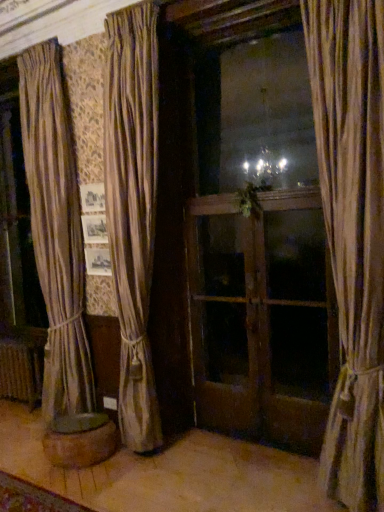
Where is `vacant area that lies between silky beige curtain at center, which ranks as the 1th curtain in back-to-front order, and brown wood stool at lower left`? Image resolution: width=384 pixels, height=512 pixels. vacant area that lies between silky beige curtain at center, which ranks as the 1th curtain in back-to-front order, and brown wood stool at lower left is located at coordinates (129, 465).